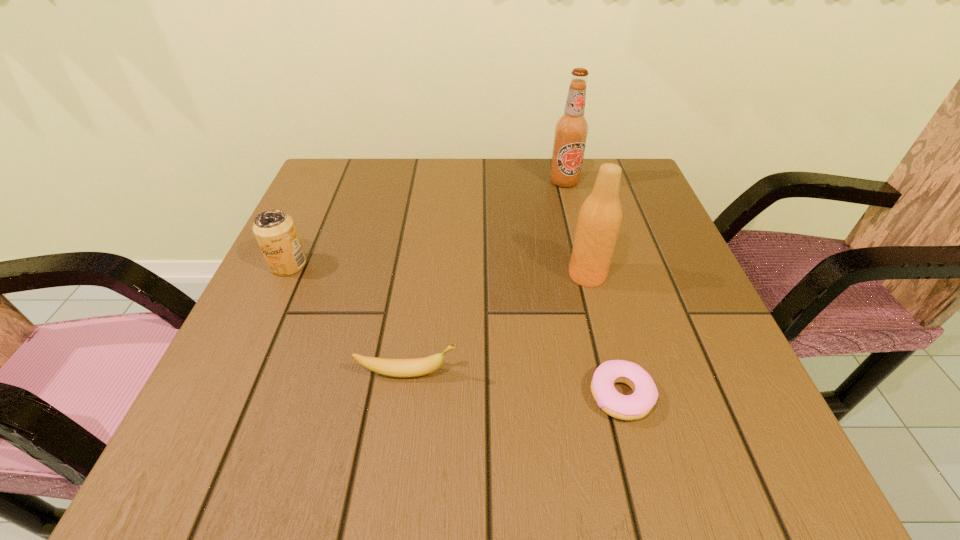
Where is `the farther beer bottle`? The width and height of the screenshot is (960, 540). the farther beer bottle is located at coordinates (571, 130).

In order to click on the nearer beer bottle in this screenshot , I will do [600, 216].

This screenshot has height=540, width=960. What are the coordinates of `the leftmost object` in the screenshot? It's located at (275, 231).

Locate an element on the screen. This screenshot has height=540, width=960. beer can is located at coordinates (275, 231).

The width and height of the screenshot is (960, 540). I want to click on banana, so click(403, 368).

At what (x,y) coordinates should I click in order to perform the action: click on the second object from left to right. Please return your answer as a coordinate pair (x, y). The height and width of the screenshot is (540, 960). Looking at the image, I should click on point(403,368).

Locate an element on the screen. This screenshot has width=960, height=540. doughnut is located at coordinates 645,394.

I want to click on vacant space located 0.170m on the front label of the farthest object, so click(577, 233).

Locate an element on the screen. This screenshot has width=960, height=540. vacant space located 0.100m on the right of the nearer beer bottle is located at coordinates (656, 275).

This screenshot has width=960, height=540. Identify the location of blank space located 0.370m on the back of the third tallest object. (335, 164).